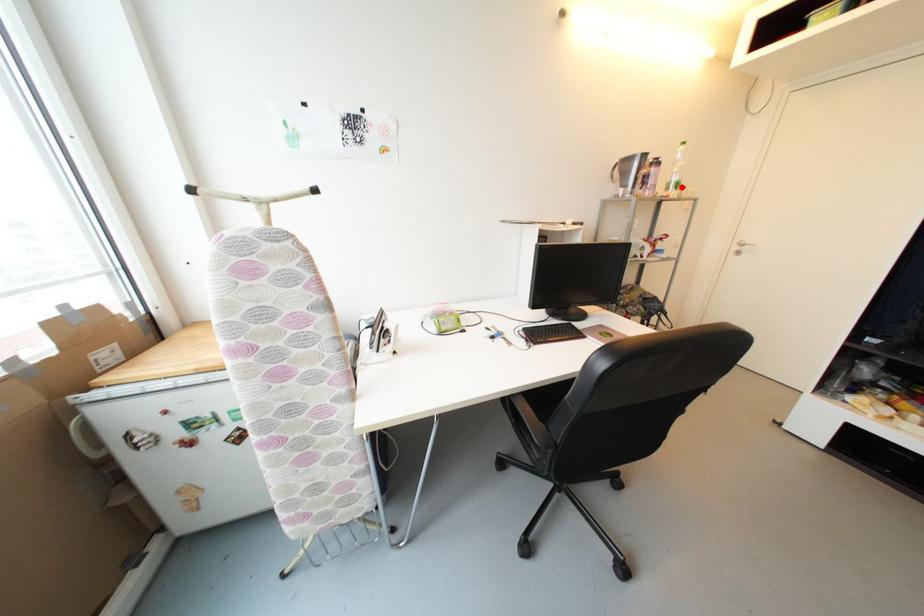
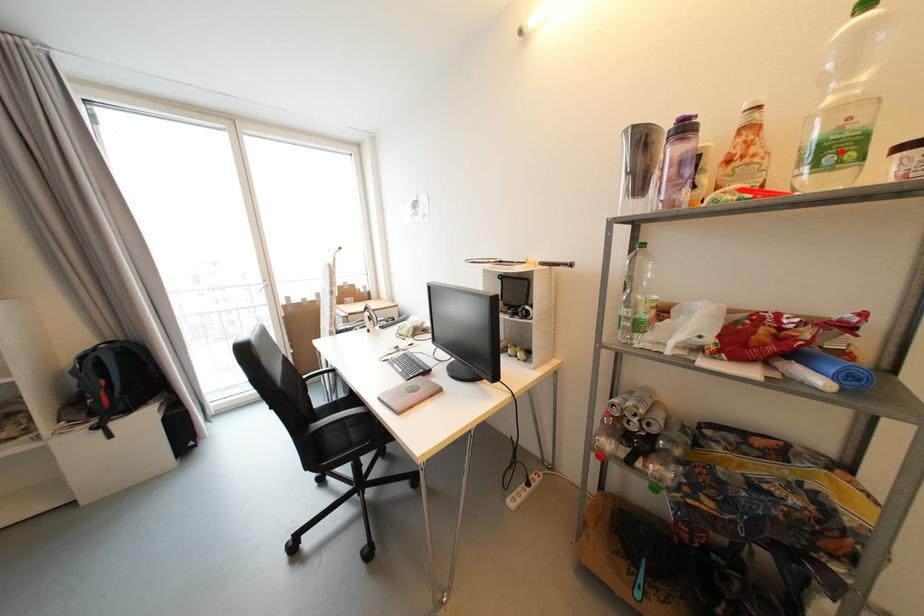
I am providing you with two images of the same scene from different viewpoints. A red point is marked on the first image and another point is marked on the second image. Are the points marked in image1 and image2 representing the same 3D position?

Yes